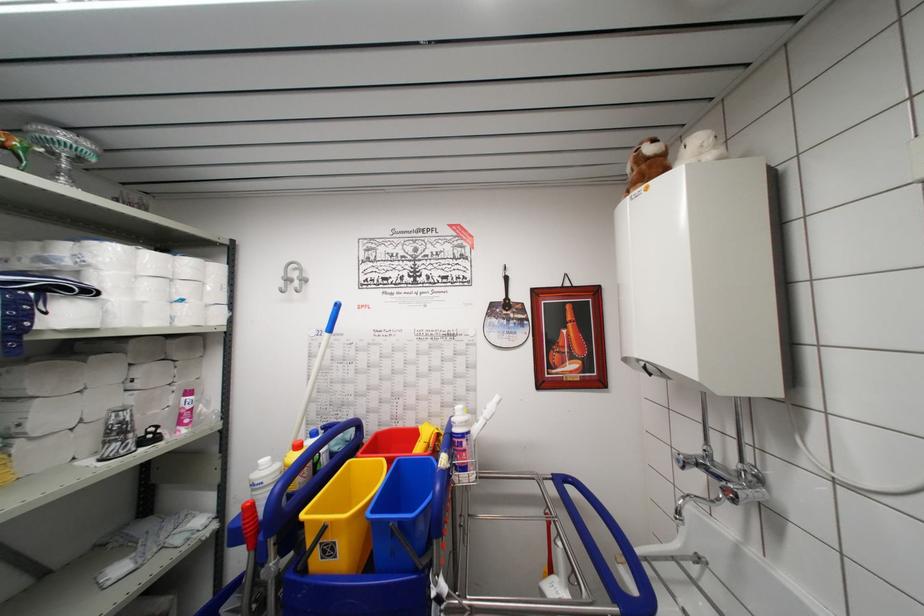
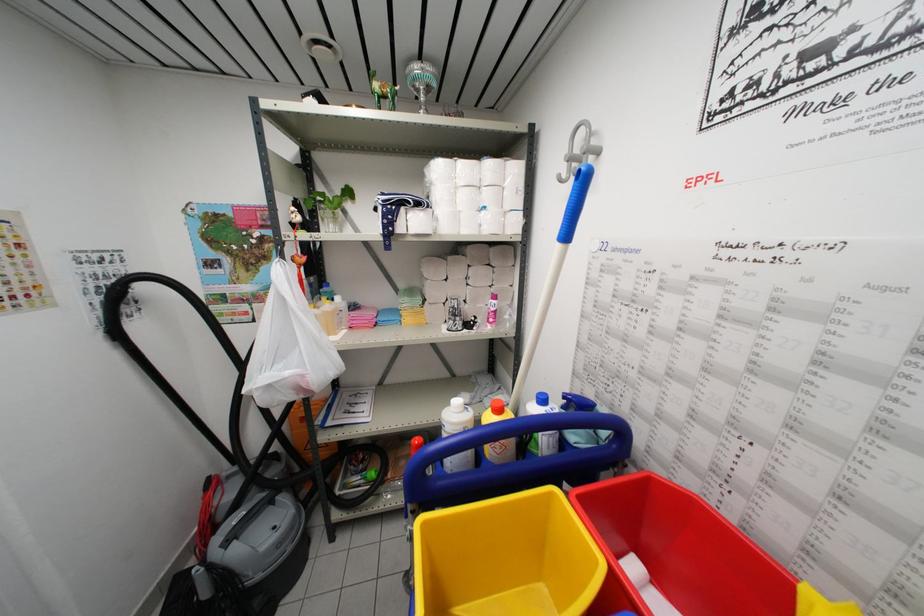
Find the pixel in the second image that matches [211,310] in the first image.

(507, 217)